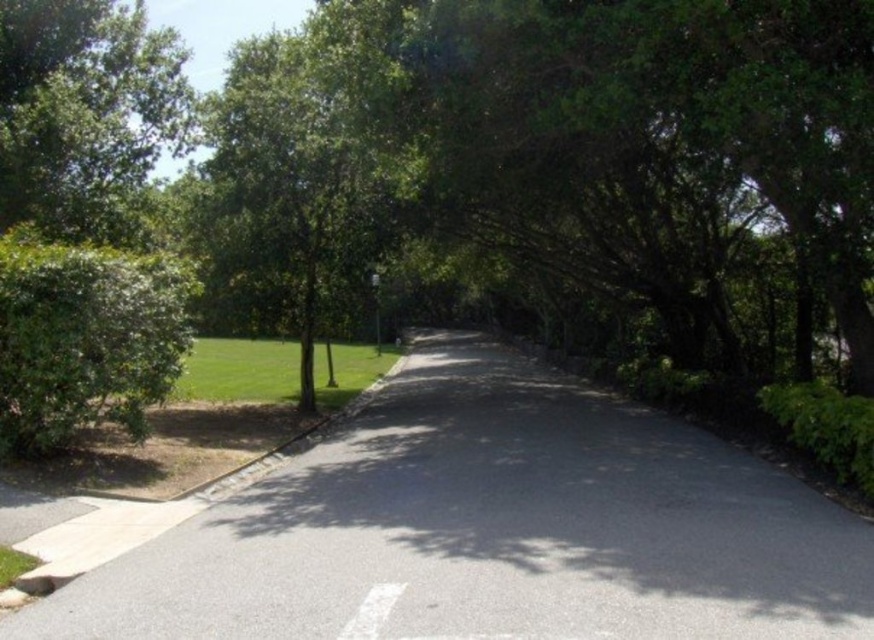
You are driving a car and see two points on the road ahead. The first point is at coordinates point (383, 600) and the second is at point (376, 332). Which point is closer to your current position?

Point (376, 332) is closer to your current position because it is behind point (383, 600), which is further ahead on the road.